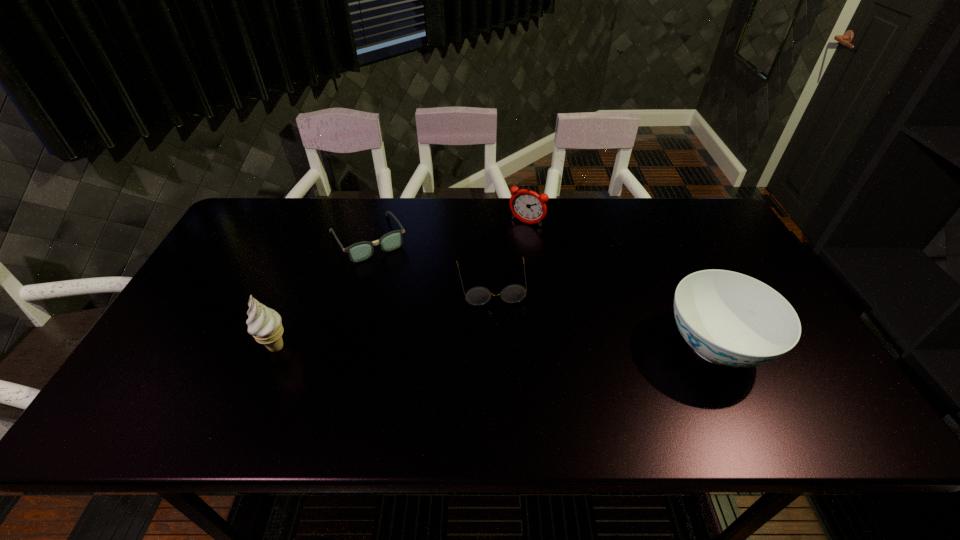
I want to click on icecream, so [264, 323].

Where is `chinaware`? The width and height of the screenshot is (960, 540). chinaware is located at coordinates (728, 318).

This screenshot has height=540, width=960. Find the location of `the left spectacles`. the left spectacles is located at coordinates (360, 251).

You are a GUI agent. You are given a task and a screenshot of the screen. Output one action in this format:
    pyautogui.click(x=<x>, y=<y>)
    Task: Click on the alarm clock
    This screenshot has height=540, width=960.
    Given the screenshot: What is the action you would take?
    pyautogui.click(x=526, y=205)

Locate an element on the screen. the right spectacles is located at coordinates (514, 293).

Locate an element on the screen. The image size is (960, 540). vacant space positioned on the front-facing side of the tallest object is located at coordinates (381, 347).

This screenshot has width=960, height=540. What are the coordinates of `free region located 0.130m on the left of the chinaware` in the screenshot? It's located at (609, 346).

Find the location of a particular element. The width and height of the screenshot is (960, 540). free space located on the face of the left spectacles is located at coordinates (396, 285).

The height and width of the screenshot is (540, 960). I want to click on vacant space positioned on the face of the left spectacles, so click(x=432, y=347).

Find the location of a particular element. Image resolution: width=960 pixels, height=540 pixels. vacant space positioned 0.050m on the face of the left spectacles is located at coordinates (388, 272).